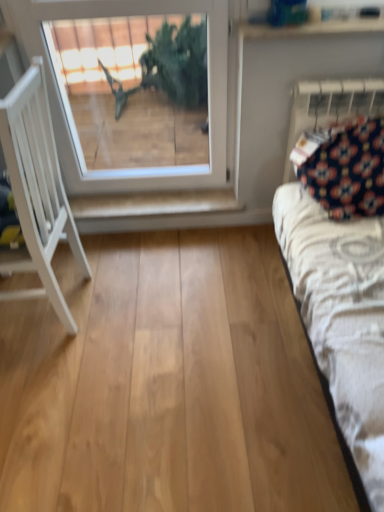
I want to click on vacant region above white painted wood shelf at center (from a real-world perspective), so click(155, 200).